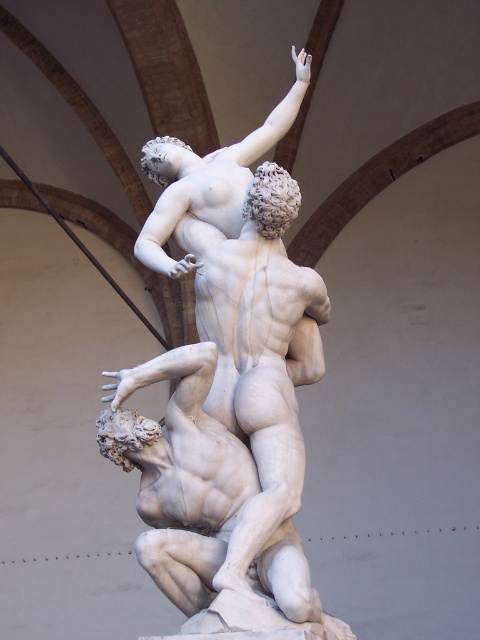
Question: Is white marble sculpture at center positioned in front of white marble statue at upper center?

Choices:
 (A) no
 (B) yes

Answer: (B)

Question: Which point is farther to the camera?

Choices:
 (A) white marble statue at upper center
 (B) white marble statue at center
 (C) white marble sculpture at center

Answer: (A)

Question: Which point is closer to the camera?

Choices:
 (A) (309, 54)
 (B) (220, 499)
 (C) (259, 538)

Answer: (C)

Question: Can you confirm if white marble sculpture at center is smaller than white marble statue at upper center?

Choices:
 (A) no
 (B) yes

Answer: (B)

Question: Does white marble sculpture at center have a larger size compared to white marble statue at upper center?

Choices:
 (A) no
 (B) yes

Answer: (A)

Question: Among these points, which one is farthest from the camera?

Choices:
 (A) 192,172
 (B) 144,499
 (C) 121,465

Answer: (A)